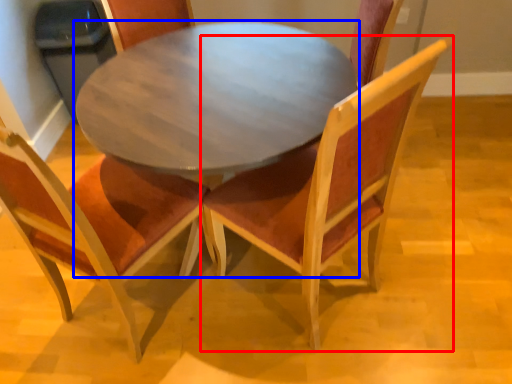
Question: Among these objects, which one is farthest to the camera, chair (highlighted by a red box) or coffee table (highlighted by a blue box)?

Choices:
 (A) chair
 (B) coffee table

Answer: (B)